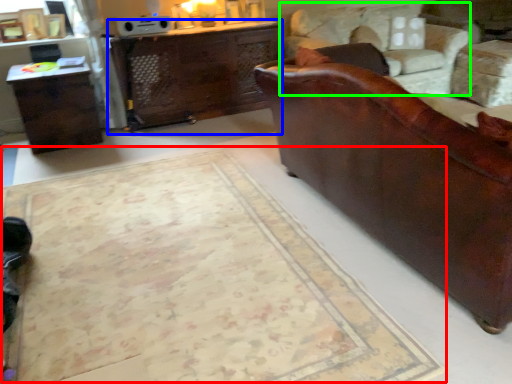
Question: Which object is the farthest from mat (highlighted by a red box)? Choose among these: desk (highlighted by a blue box) or swivel chair (highlighted by a green box).

Choices:
 (A) desk
 (B) swivel chair

Answer: (B)